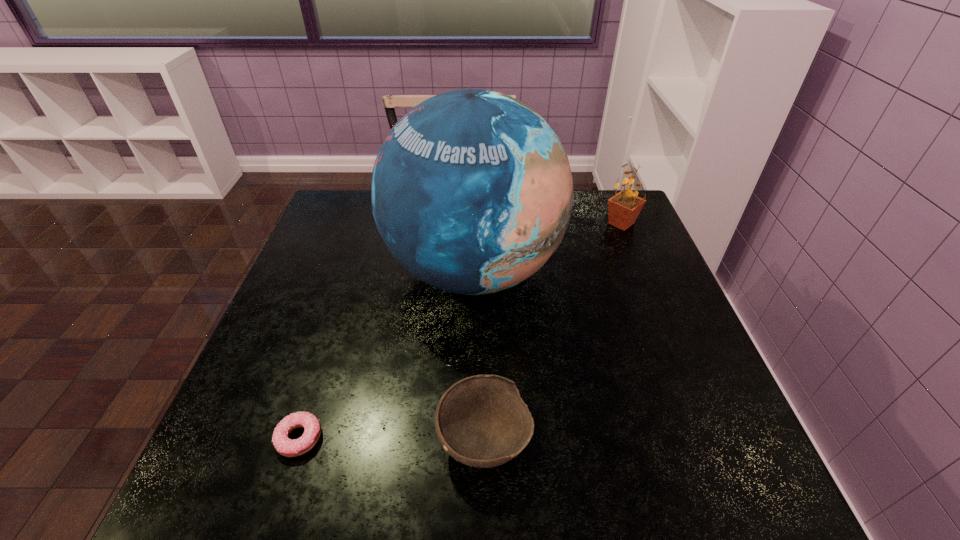
In the image, there is a desktop. Identify the location of free space at the near edge. point(502,469).

Where is `vacant region at the left edge of the desktop`? This screenshot has width=960, height=540. vacant region at the left edge of the desktop is located at coordinates (261, 396).

Where is `blank space at the right edge`? The image size is (960, 540). blank space at the right edge is located at coordinates (687, 323).

Find the location of a particular element. The image size is (960, 540). vacant space at the far left corner is located at coordinates (359, 223).

This screenshot has height=540, width=960. Find the location of `vacant region at the near right corner of the desktop`. vacant region at the near right corner of the desktop is located at coordinates (735, 462).

You are a GUI agent. You are given a task and a screenshot of the screen. Output one action in this format:
    pyautogui.click(x=<x>, y=<y>)
    Task: Click on the vacant region between the third shortest object and the leftmost object
    The width and height of the screenshot is (960, 540).
    Given the screenshot: What is the action you would take?
    pyautogui.click(x=461, y=330)

I want to click on free space between the second shortest object and the globe, so click(479, 355).

Where is `vacant space in between the shortest object and the rightmost object`? The image size is (960, 540). vacant space in between the shortest object and the rightmost object is located at coordinates (461, 330).

Identify the location of vacant space that is in between the bowl and the shortest object. (392, 438).

Find the location of `vacant area between the sunflower and the bowl`. vacant area between the sunflower and the bowl is located at coordinates (553, 331).